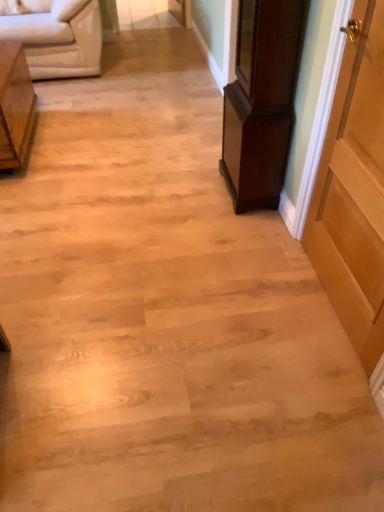
You are a GUI agent. You are given a task and a screenshot of the screen. Output one action in this format:
    pyautogui.click(x=<x>, y=<y>)
    Task: Click on the vacant space in between light brown wood door at right and dark wood cabinet at right, which ranks as the 2th furniture in left-to-right order
    This screenshot has width=384, height=512.
    Given the screenshot: What is the action you would take?
    pyautogui.click(x=277, y=258)